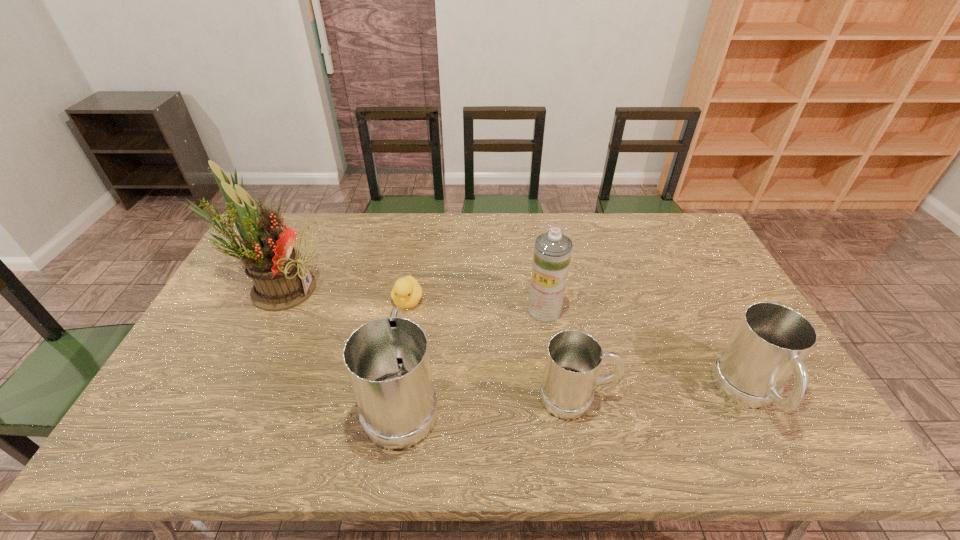
This screenshot has height=540, width=960. I want to click on free location at the near edge, so click(696, 388).

Image resolution: width=960 pixels, height=540 pixels. Find the location of `free space at the left edge of the desktop`. free space at the left edge of the desktop is located at coordinates (169, 383).

You are a GUI agent. You are given a task and a screenshot of the screen. Output one action in this format:
    pyautogui.click(x=<x>, y=<y>)
    Task: Click on the blank space at the right edge of the desktop
    The width and height of the screenshot is (960, 540).
    Given the screenshot: What is the action you would take?
    pyautogui.click(x=683, y=258)

Image resolution: width=960 pixels, height=540 pixels. I want to click on blank region between the shortest object and the leftmost object, so click(343, 295).

The height and width of the screenshot is (540, 960). I want to click on free space between the second mug from left to right and the duck, so click(x=492, y=349).

The width and height of the screenshot is (960, 540). I want to click on vacant area between the rightmost mug and the fifth tallest object, so click(663, 395).

Locate an element on the screen. This screenshot has width=960, height=540. vacant region between the aerosol can and the duck is located at coordinates (476, 306).

At what (x,y) coordinates should I click in order to perform the action: click on vacant region between the flower arrangement and the rightmost object. Please return your answer as a coordinate pair (x, y). Looking at the image, I should click on (x=514, y=341).

What are the coordinates of `unoccupied position between the leftmost mug and the shortest mug` in the screenshot? It's located at (490, 399).

Where is `free space between the rightmost object and the second mug from right to left`? free space between the rightmost object and the second mug from right to left is located at coordinates (663, 395).